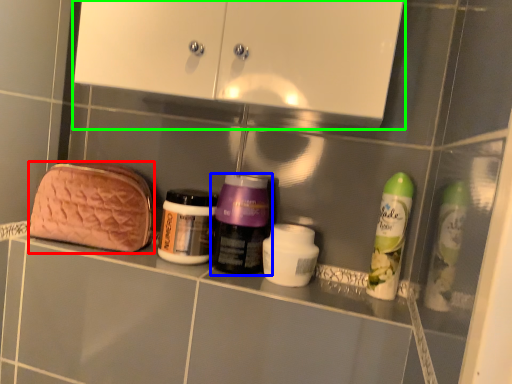
Question: Based on their relative distances, which object is farther from pouch (highlighted by a red box)? Choose from bottle (highlighted by a blue box) and medicine cabinet (highlighted by a green box).

Choices:
 (A) bottle
 (B) medicine cabinet

Answer: (B)